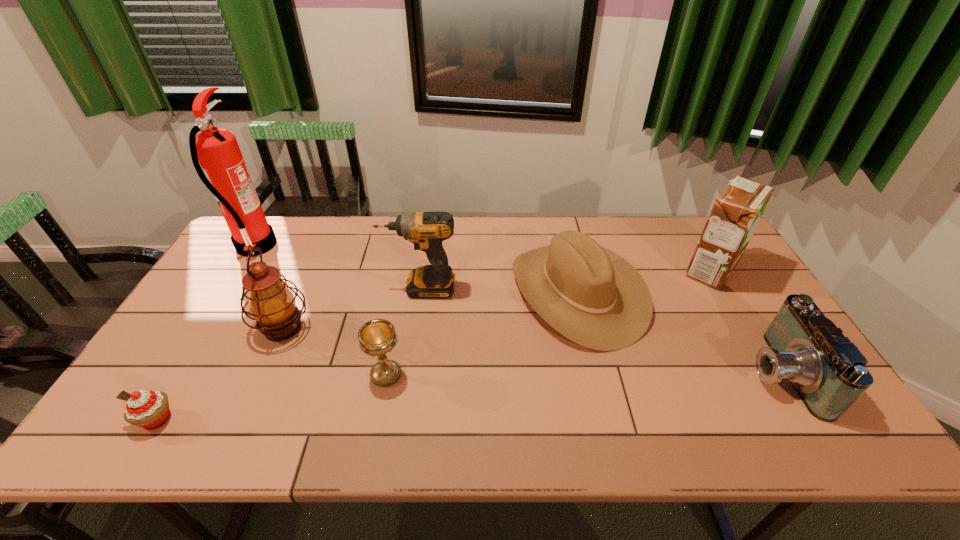
In order to click on the tallest object in this screenshot , I will do `click(224, 172)`.

The image size is (960, 540). Find the location of `carton`. carton is located at coordinates (737, 210).

Where is `the sixth object from right to left`? The height and width of the screenshot is (540, 960). the sixth object from right to left is located at coordinates (272, 305).

Locate an element on the screen. The height and width of the screenshot is (540, 960). drill is located at coordinates (426, 230).

You are a GUI agent. You are given a task and a screenshot of the screen. Output one action in this format:
    pyautogui.click(x=<x>, y=<y>)
    Task: Click on the sixth object from left to right
    This screenshot has height=540, width=960.
    Given the screenshot: What is the action you would take?
    pyautogui.click(x=591, y=295)

Locate an element on the screen. camcorder is located at coordinates (828, 372).

This screenshot has height=540, width=960. What are the coordinates of `chalice` in the screenshot? It's located at (377, 337).

I want to click on cupcake, so click(148, 409).

Image resolution: width=960 pixels, height=540 pixels. Find the location of `vacant area located with the nozzle aimed from the fire extinguisher`. vacant area located with the nozzle aimed from the fire extinguisher is located at coordinates (391, 246).

Locate an element on the screen. This screenshot has width=960, height=540. vacant region located on the straw side of the carton is located at coordinates click(592, 270).